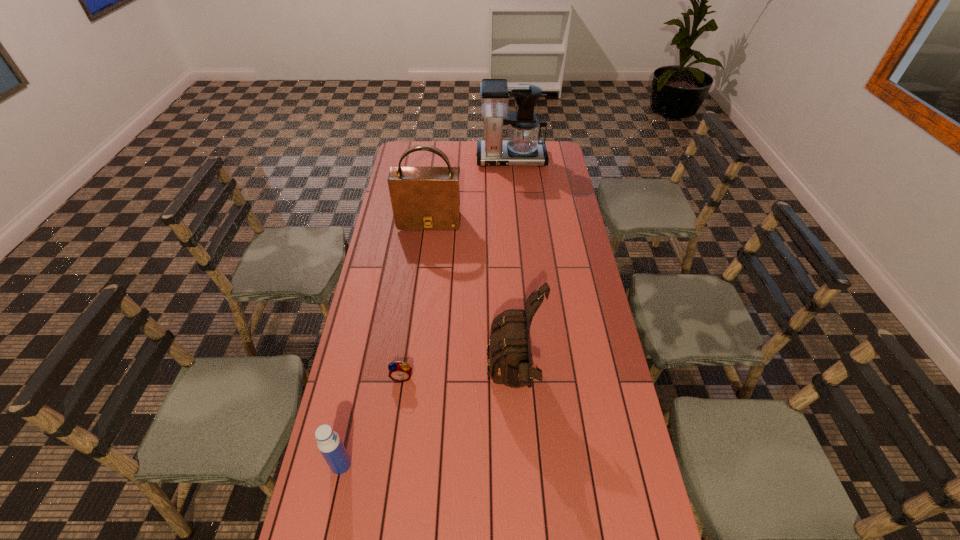
You are a GUI agent. You are given a task and a screenshot of the screen. Output one action in this format:
    pyautogui.click(x=<x>, y=<y>)
    Task: Click on the free space that is in between the right shoulder bag and the farther shoulder bag
    The width and height of the screenshot is (960, 540).
    Given the screenshot: What is the action you would take?
    pyautogui.click(x=471, y=302)

Choose which object is the nearest neighbor to the nearest object. Please provide its 2D coordinates. Your answer should be formatted as a tuple, i.e. [(x, y)], where the tuple contains the x and y coordinates of a point satisfying the conditions above.

[(401, 371)]

Locate an element on the screen. The image size is (960, 540). object that is the third closest to the fourth tallest object is located at coordinates (423, 197).